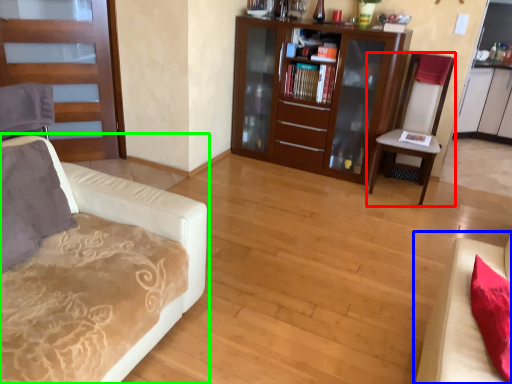
Question: Which is farther away from chair (highlighted by a red box)? studio couch (highlighted by a blue box) or studio couch (highlighted by a green box)?

Choices:
 (A) studio couch
 (B) studio couch

Answer: (B)